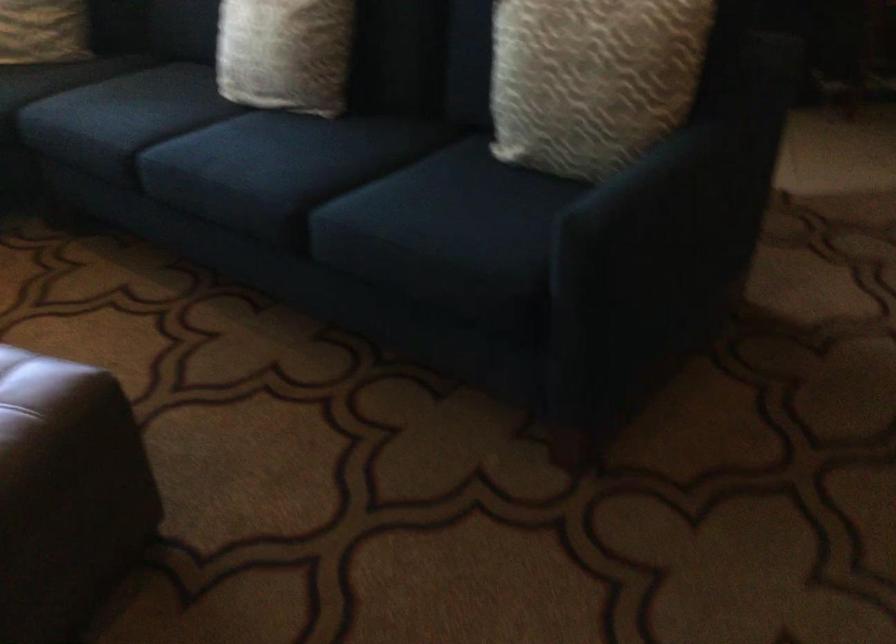
The height and width of the screenshot is (644, 896). Describe the element at coordinates (245, 154) in the screenshot. I see `the sofa sitting surface` at that location.